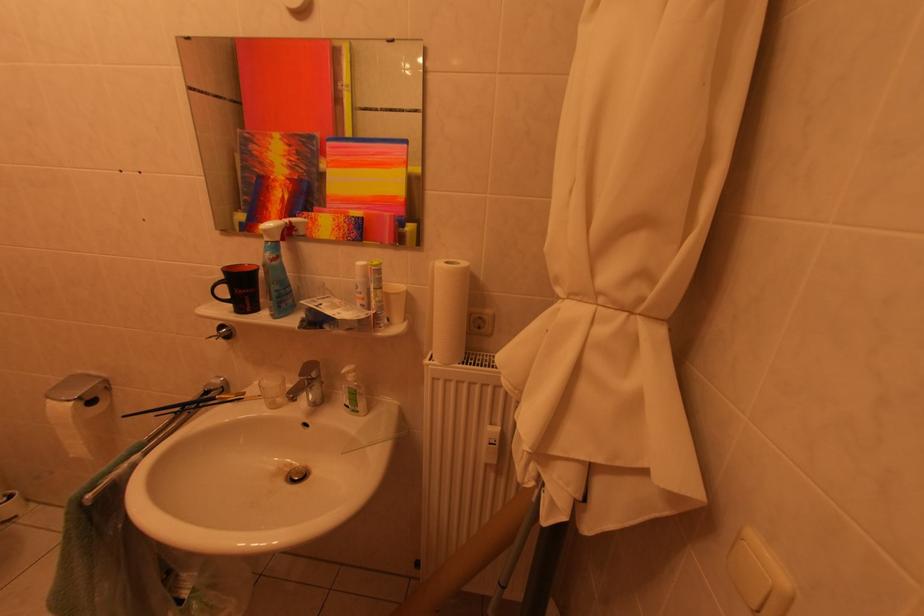
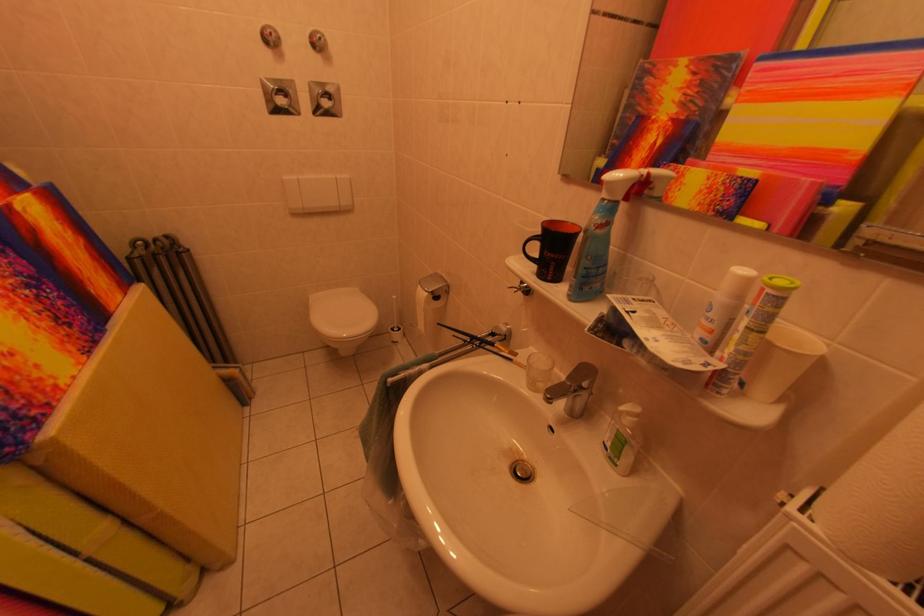
The point at (309, 379) is marked in the first image. Where is the corresponding point in the second image?

(578, 382)